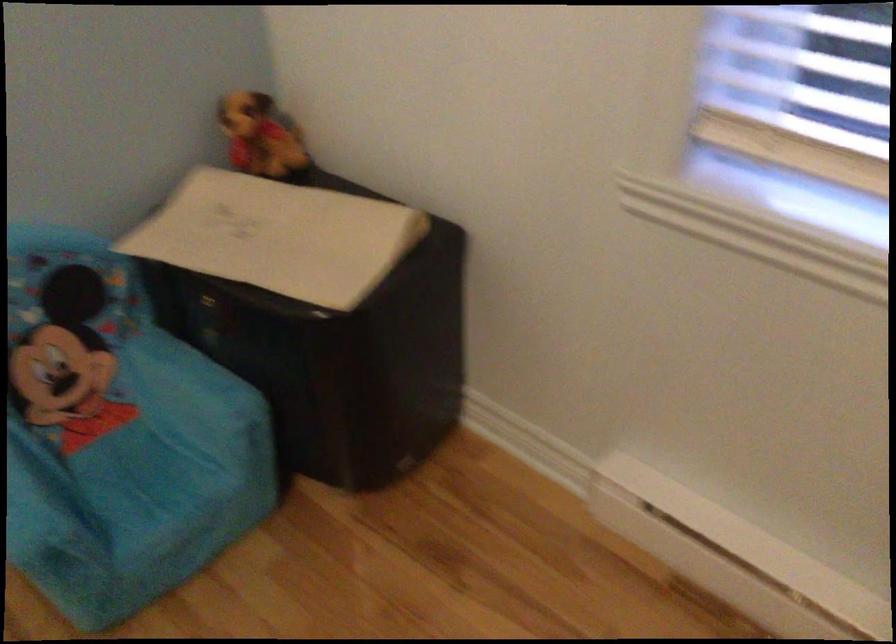
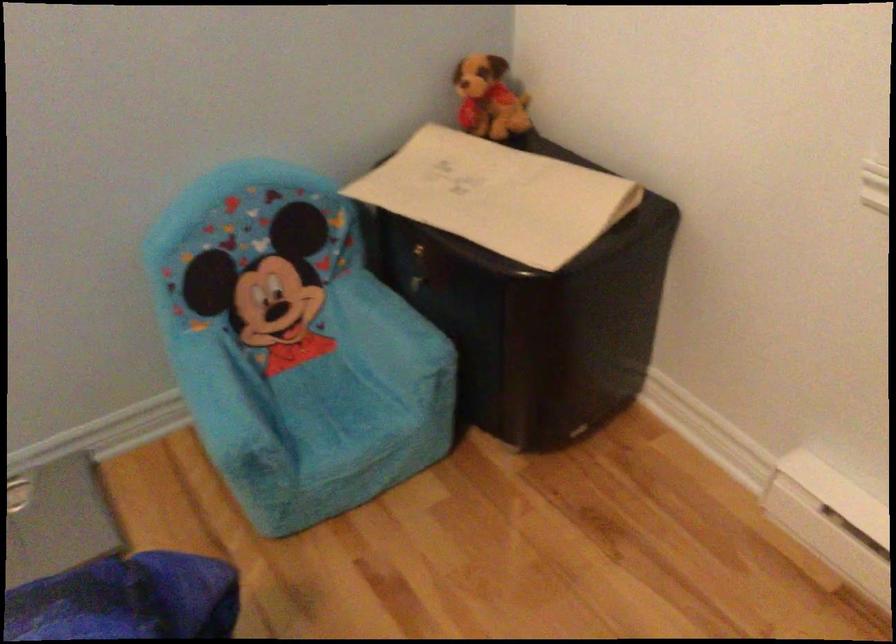
The point at (x=219, y=346) is marked in the first image. Where is the corresponding point in the second image?

(419, 292)